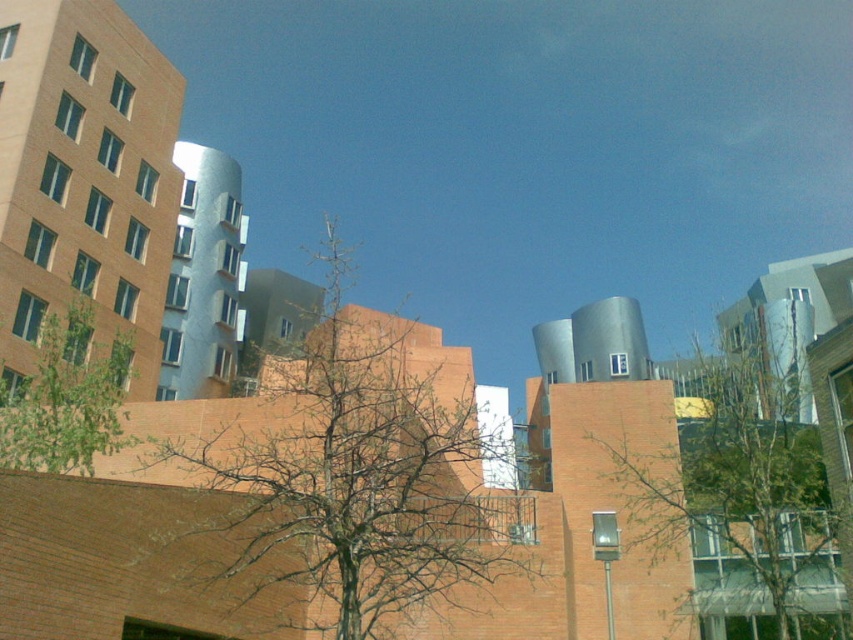
Is bare branches at center to the right of green leafy tree at center from the viewer's perspective?

In fact, bare branches at center is to the left of green leafy tree at center.

Which is more to the left, bare branches at center or green leafy tree at center?

Positioned to the left is bare branches at center.

The image size is (853, 640). Describe the element at coordinates (363, 476) in the screenshot. I see `bare branches at center` at that location.

In order to click on bare branches at center in this screenshot , I will do `click(363, 476)`.

Is bare branches at center above green leafy tree at left?

Correct, bare branches at center is located above green leafy tree at left.

Describe the element at coordinates (363, 476) in the screenshot. I see `bare branches at center` at that location.

Where is `bare branches at center`? The height and width of the screenshot is (640, 853). bare branches at center is located at coordinates (363, 476).

Between green leafy tree at center and green leafy tree at left, which one is positioned higher?

green leafy tree at left

What are the coordinates of `green leafy tree at center` in the screenshot? It's located at (741, 490).

Is point (698, 529) farther from camera compared to point (117, 388)?

Yes, it is.

Image resolution: width=853 pixels, height=640 pixels. Find the location of `green leafy tree at center`. green leafy tree at center is located at coordinates (741, 490).